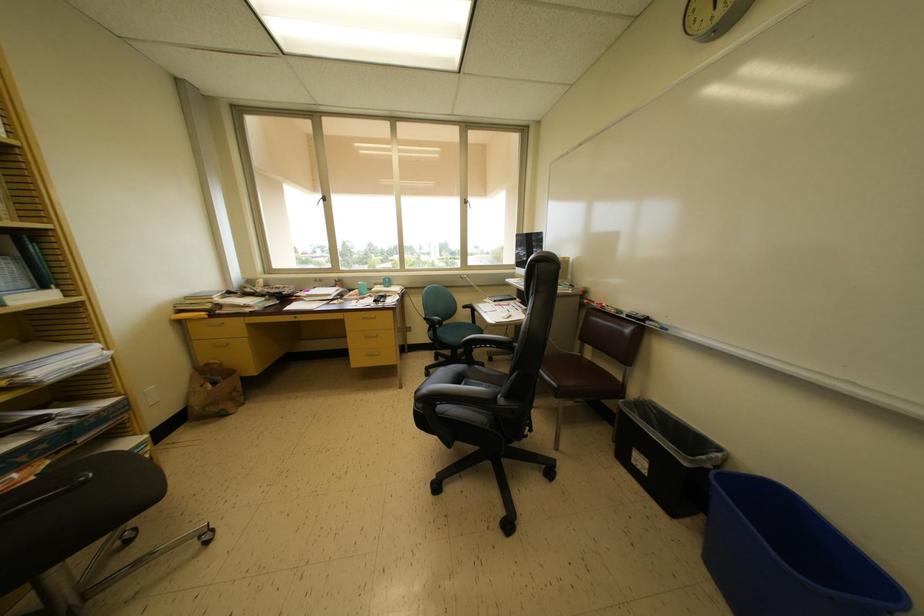
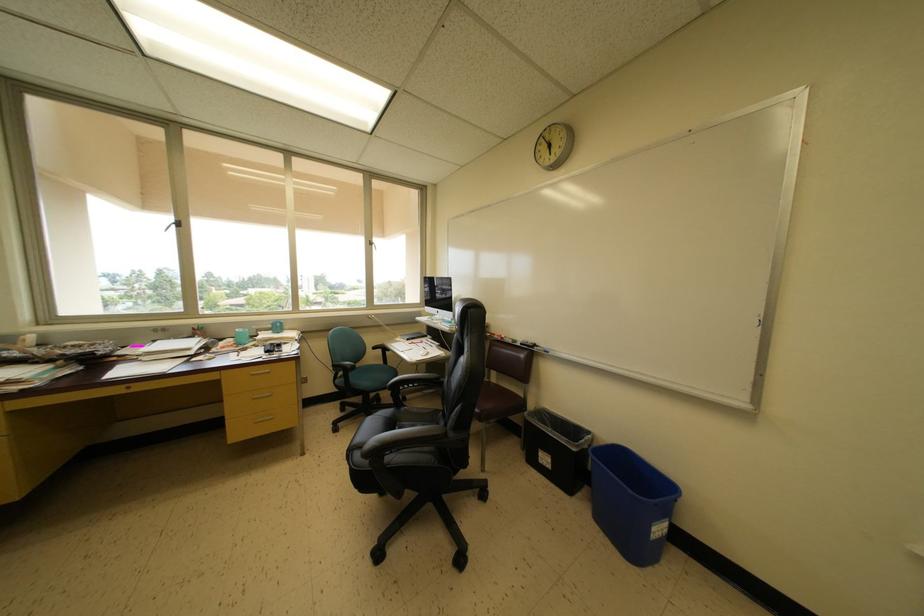
Question: The images are taken continuously from a first-person perspective. In which direction is your viewpoint rotating?

Choices:
 (A) Left
 (B) Right
 (C) Up
 (D) Down

Answer: (B)